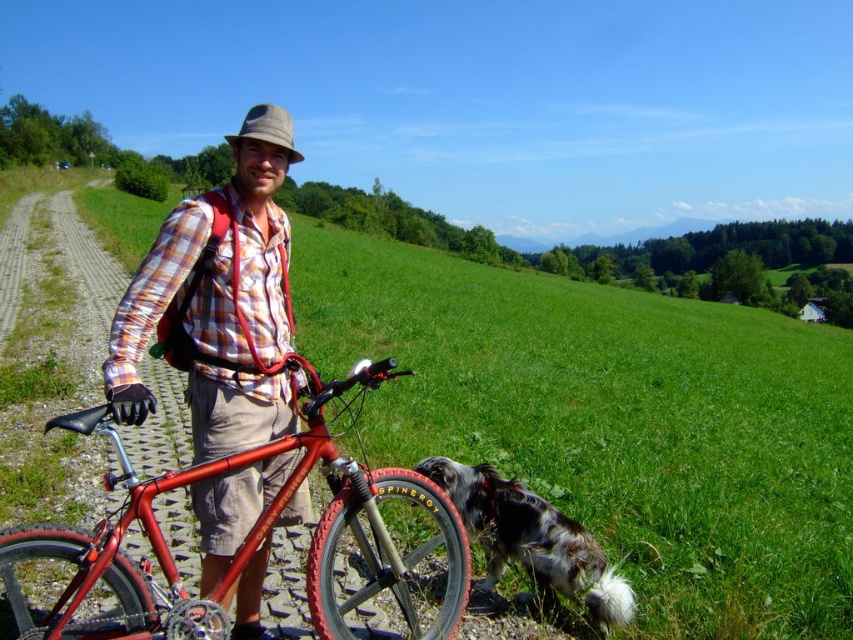
You are planning to set up a small tent in the smooth green grass at center. Considering the shiny metallic bicycle at left is currently parked there, will there be enough space to place the tent without moving the bicycle?

The smooth green grass at center is wider than the shiny metallic bicycle at left, so there should be enough space to place the tent without moving the bicycle.

You are standing at point A, which is the location of the red bicycle in the scene. You want to walk straight ahead to the smooth green grass at center located at point B, which is at coordinates point [614,420]. Is there any obstacle between you and the grass?

The smooth green grass at center is located at point [614,420], which is directly ahead of the red bicycle. There are no obstacles mentioned between the red bicycle and the smooth green grass at center, so the path is clear.

You are a hiker who wants to sit down to rest. You see the smooth green grass at center and the black and white fur at lower right. Which area would be more comfortable to sit on?

The smooth green grass at center is taller than the black and white fur at lower right, so sitting on the smooth green grass at center would be more comfortable.